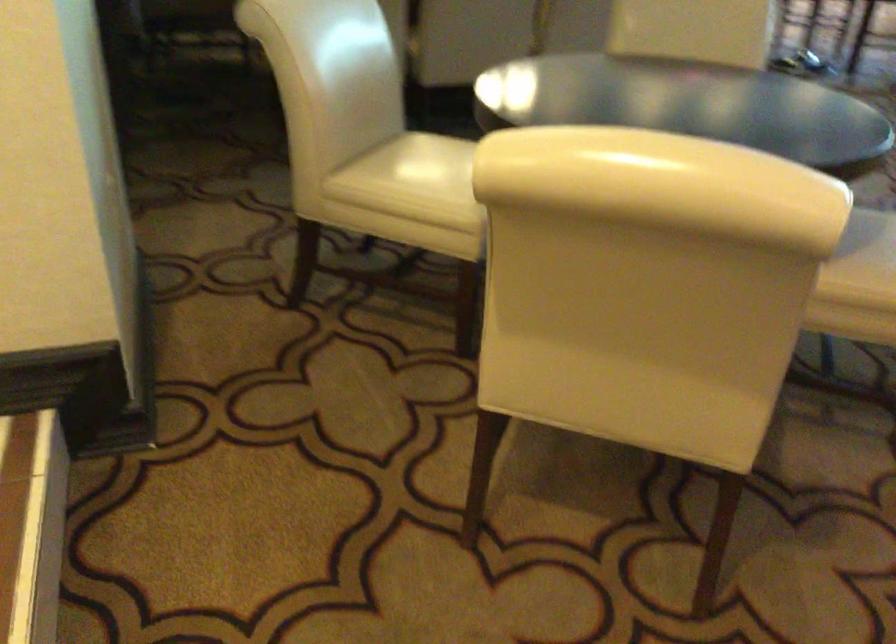
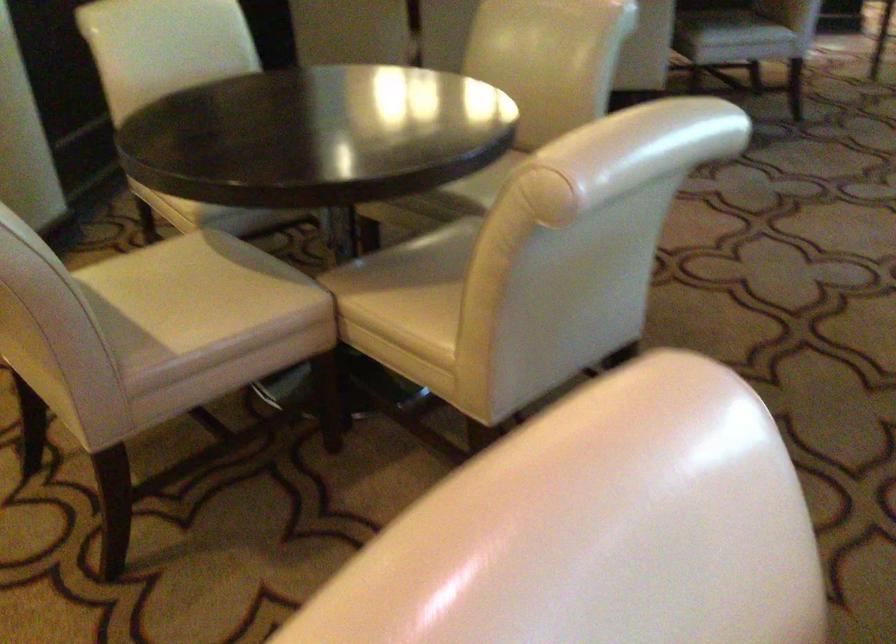
Question: What movement of the cameraman would produce the second image?

Choices:
 (A) Left
 (B) Right
 (C) Forward
 (D) Backward

Answer: (B)